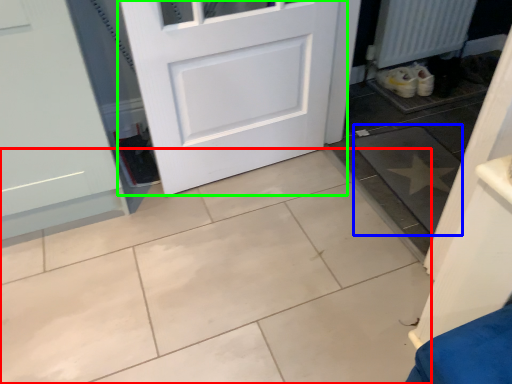
Question: Which object is positioned closest to ceramic tile (highlighted by a red box)? Select from ceramic tile (highlighted by a blue box) and door (highlighted by a green box).

Choices:
 (A) ceramic tile
 (B) door

Answer: (B)